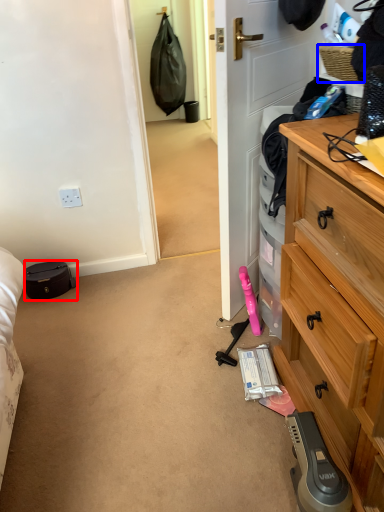
Question: Which of the following is the farthest to the observer, luggage and bags (highlighted by a red box) or picnic basket (highlighted by a blue box)?

Choices:
 (A) luggage and bags
 (B) picnic basket

Answer: (A)